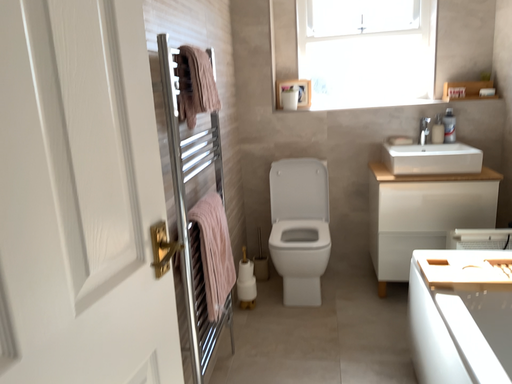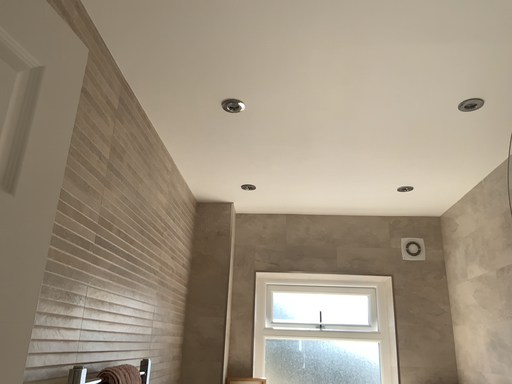
Question: Which way did the camera rotate in the video?

Choices:
 (A) rotated upward
 (B) rotated downward

Answer: (A)